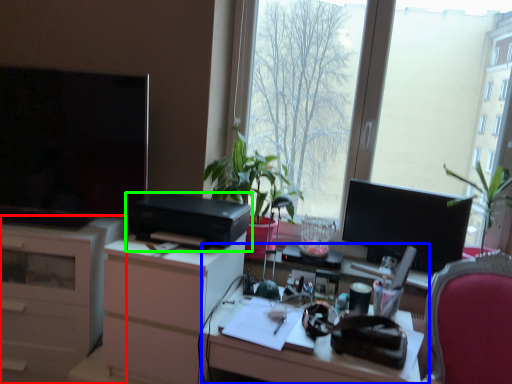
Question: Which object is the closest to the cabinetry (highlighted by a red box)? Choose among these: computer desk (highlighted by a blue box) or printer (highlighted by a green box).

Choices:
 (A) computer desk
 (B) printer

Answer: (B)